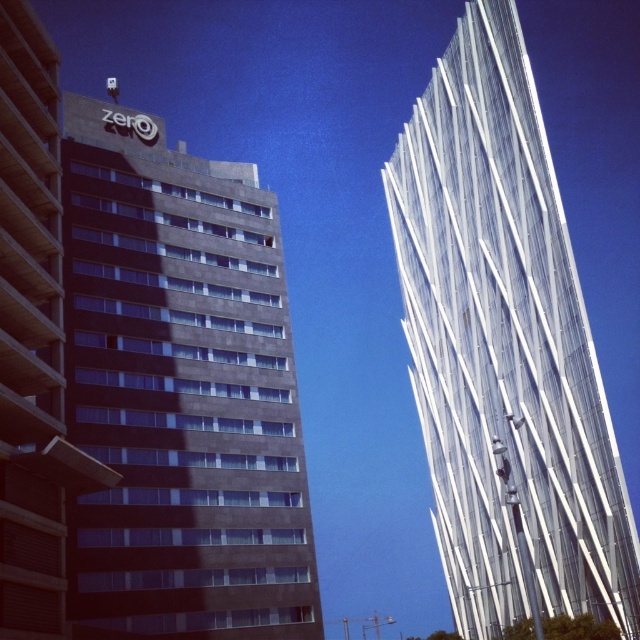
Question: Does dark gray concrete building at center lie in front of transparent glass tower at right?

Choices:
 (A) yes
 (B) no

Answer: (B)

Question: Is dark gray concrete building at center above transparent glass tower at right?

Choices:
 (A) no
 (B) yes

Answer: (B)

Question: Which object is farther from the camera taking this photo?

Choices:
 (A) transparent glass tower at right
 (B) dark gray concrete building at center

Answer: (B)

Question: Which object is farther from the camera taking this photo?

Choices:
 (A) dark gray concrete building at left
 (B) transparent glass tower at right

Answer: (B)

Question: Does dark gray concrete building at center appear over dark gray concrete building at left?

Choices:
 (A) no
 (B) yes

Answer: (A)

Question: Which of these objects is positioned farthest from the transparent glass tower at right?

Choices:
 (A) dark gray concrete building at left
 (B) dark gray concrete building at center

Answer: (A)